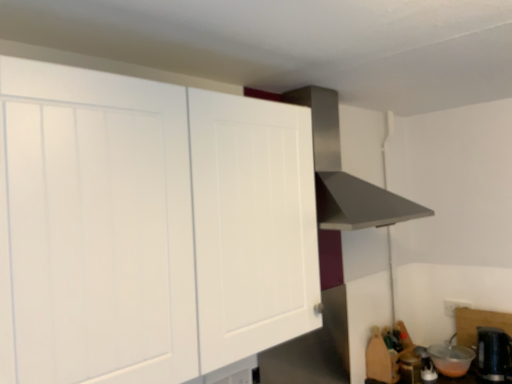
Question: Is the depth of white glossy kettle at lower right, which is the 3th appliance in right-to-left order, greater than that of transparent plastic bowl at lower right, which appears as the third appliance when viewed from the left?

Choices:
 (A) yes
 (B) no

Answer: (A)

Question: From a real-world perspective, is white glossy kettle at lower right, which is the 3th appliance in right-to-left order, located higher than transparent plastic bowl at lower right, the 2th appliance viewed from the right?

Choices:
 (A) yes
 (B) no

Answer: (B)

Question: Considering the relative sizes of white glossy kettle at lower right, acting as the 2th appliance starting from the left, and transparent plastic bowl at lower right, the 2th appliance viewed from the right, in the image provided, is white glossy kettle at lower right, acting as the 2th appliance starting from the left, taller than transparent plastic bowl at lower right, the 2th appliance viewed from the right,?

Choices:
 (A) no
 (B) yes

Answer: (A)

Question: Considering the relative sizes of white glossy kettle at lower right, which is the 3th appliance in right-to-left order, and transparent plastic bowl at lower right, which appears as the third appliance when viewed from the left, in the image provided, is white glossy kettle at lower right, which is the 3th appliance in right-to-left order, wider than transparent plastic bowl at lower right, which appears as the third appliance when viewed from the left,?

Choices:
 (A) no
 (B) yes

Answer: (A)

Question: From the image's perspective, is white glossy kettle at lower right, which is the 3th appliance in right-to-left order, located beneath transparent plastic bowl at lower right, the 2th appliance viewed from the right?

Choices:
 (A) yes
 (B) no

Answer: (A)

Question: Is white glossy kettle at lower right, acting as the 2th appliance starting from the left, bigger than transparent plastic bowl at lower right, which appears as the third appliance when viewed from the left?

Choices:
 (A) no
 (B) yes

Answer: (A)

Question: From a real-world perspective, is white matte cabinet at upper left located beneath stainless steel vent at upper center?

Choices:
 (A) yes
 (B) no

Answer: (A)

Question: From the image's perspective, is white matte cabinet at upper left on stainless steel vent at upper center?

Choices:
 (A) no
 (B) yes

Answer: (A)

Question: Is there a large distance between white matte cabinet at upper left and stainless steel vent at upper center?

Choices:
 (A) no
 (B) yes

Answer: (A)

Question: Is white matte cabinet at upper left not within stainless steel vent at upper center?

Choices:
 (A) yes
 (B) no

Answer: (A)

Question: Can you confirm if white matte cabinet at upper left is smaller than stainless steel vent at upper center?

Choices:
 (A) no
 (B) yes

Answer: (A)

Question: From a real-world perspective, is white matte cabinet at upper left positioned over stainless steel vent at upper center based on gravity?

Choices:
 (A) yes
 (B) no

Answer: (B)

Question: Is black plastic kettle at lower right, the fourth appliance positioned from the left, to the left of metallic silver toaster at lower right, placed as the first appliance when sorted from left to right, from the viewer's perspective?

Choices:
 (A) yes
 (B) no

Answer: (B)